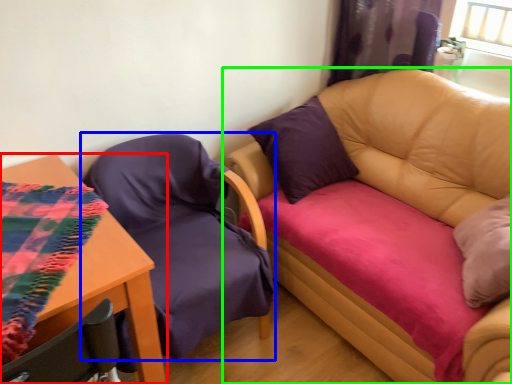
Question: Which is nearer to the table (highlighted by a red box)? chair (highlighted by a blue box) or studio couch (highlighted by a green box).

Choices:
 (A) chair
 (B) studio couch

Answer: (A)